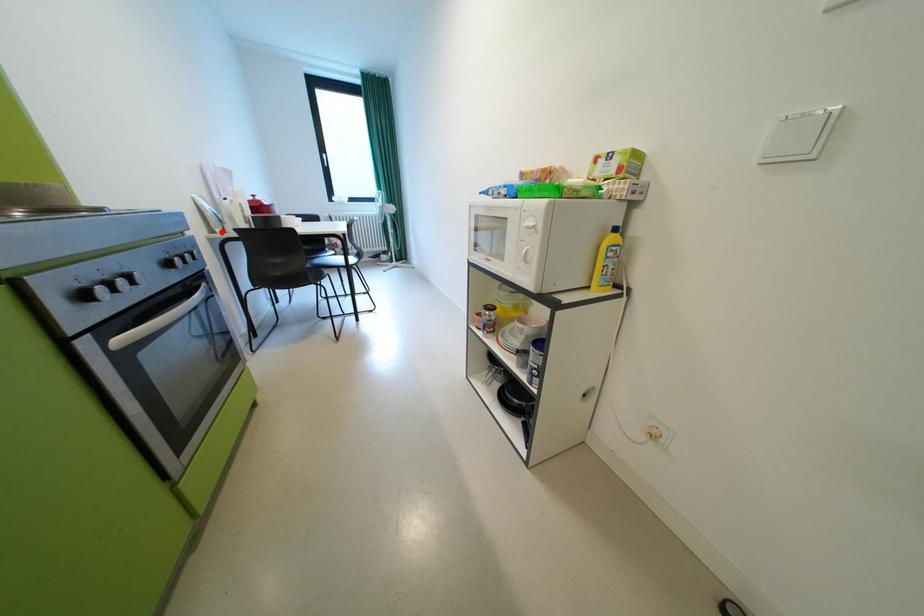
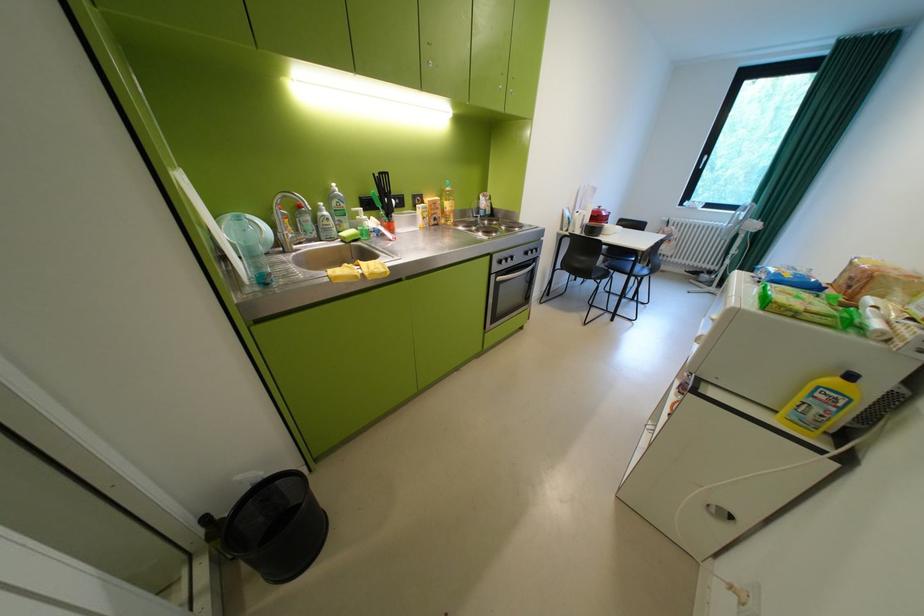
Find the pixel in the second image that matches the highlighted location in the first image.

(572, 230)